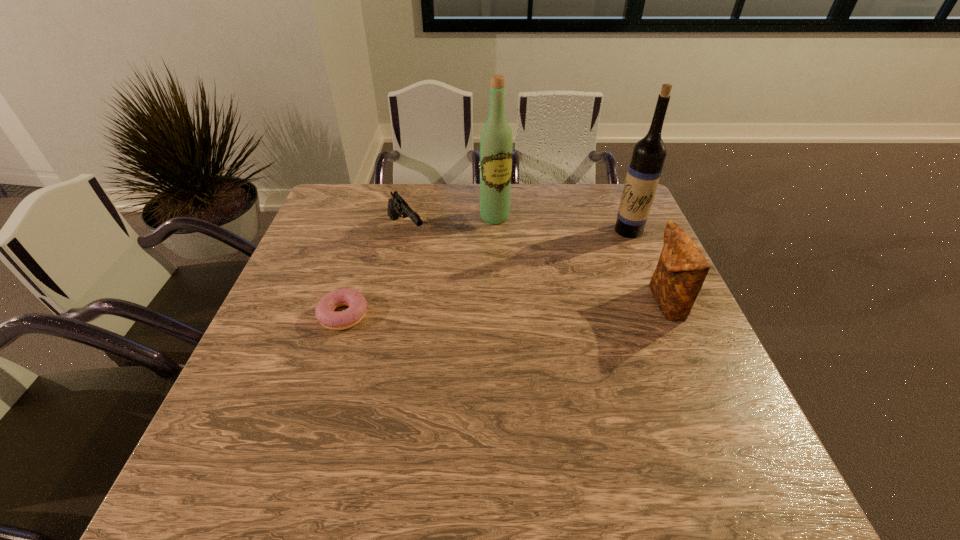
Locate an element on the screen. The height and width of the screenshot is (540, 960). clutch bag at the right edge is located at coordinates (682, 268).

Identify the location of wine bottle present at the right edge. (648, 156).

You are a GUI agent. You are given a task and a screenshot of the screen. Output one action in this format:
    pyautogui.click(x=<x>, y=<y>)
    Task: Click on the object located at the far right corner
    
    Given the screenshot: What is the action you would take?
    pyautogui.click(x=648, y=156)

This screenshot has height=540, width=960. Identify the location of free space at the far edge of the desktop. (549, 211).

At what (x,y) coordinates should I click in order to perform the action: click on vacant space at the left edge. Please return your answer as a coordinate pair (x, y). The width and height of the screenshot is (960, 540). Looking at the image, I should click on (299, 309).

Locate an element on the screen. The width and height of the screenshot is (960, 540). free space at the far left corner is located at coordinates (340, 202).

Locate an element on the screen. This screenshot has width=960, height=540. vacant space at the near left corner is located at coordinates (244, 431).

The width and height of the screenshot is (960, 540). In the image, there is a desktop. Identify the location of vacant space at the far right corner. (591, 203).

In the image, there is a desktop. What are the coordinates of `blank space at the near right corner` in the screenshot? It's located at (679, 402).

Where is `free area in between the fourth tallest object and the third object from left to right`? This screenshot has width=960, height=540. free area in between the fourth tallest object and the third object from left to right is located at coordinates (450, 224).